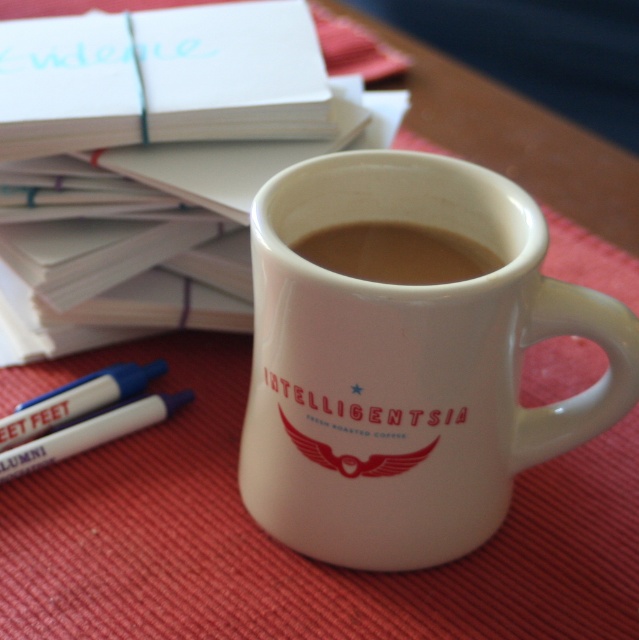
Question: Considering the real-world distances, which object is closest to the brown matte coffee at center?

Choices:
 (A) white paper at upper center
 (B) white glossy mug at center

Answer: (B)

Question: Which point is closer to the camera taking this photo?

Choices:
 (A) (314, 252)
 (B) (281, 244)

Answer: (B)

Question: Can you confirm if brown matte coffee at center is positioned below white paper at upper center?

Choices:
 (A) yes
 (B) no

Answer: (A)

Question: Considering the real-world distances, which object is closest to the white paper at upper center?

Choices:
 (A) white glossy mug at center
 (B) brown matte coffee at center

Answer: (B)

Question: From the image, what is the correct spatial relationship of brown matte coffee at center in relation to white paper at upper center?

Choices:
 (A) above
 (B) below

Answer: (B)

Question: Is white glossy mug at center to the left of white paper at upper center from the viewer's perspective?

Choices:
 (A) yes
 (B) no

Answer: (B)